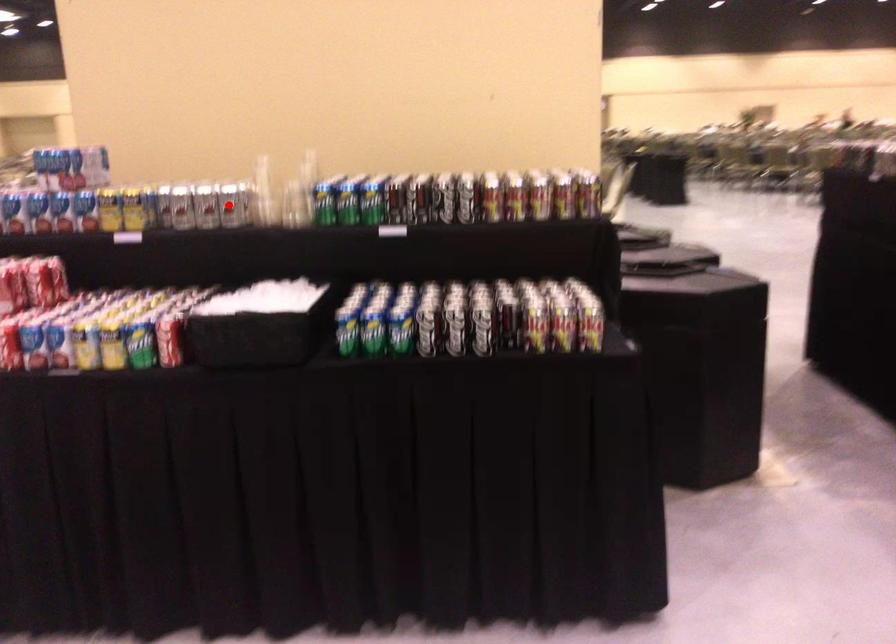
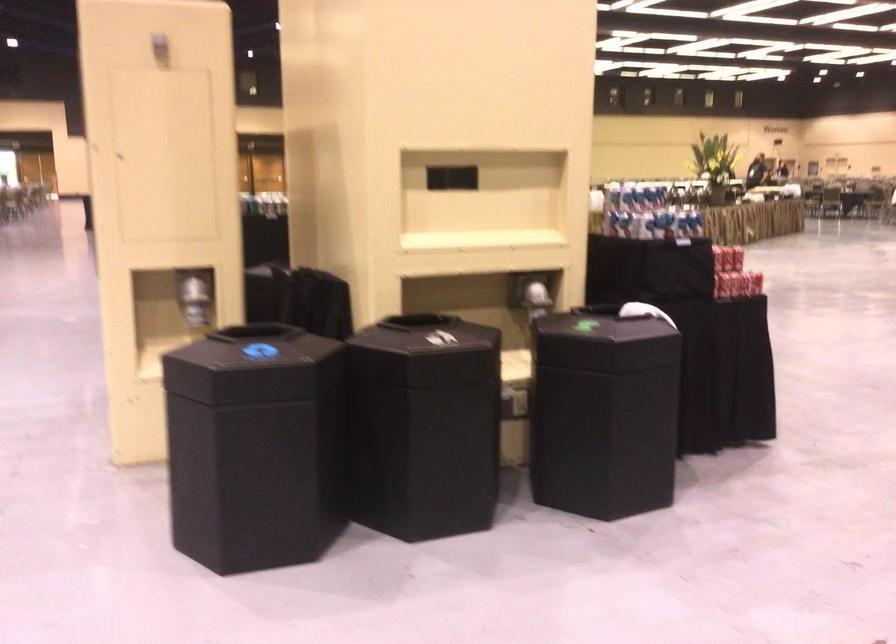
Question: I am providing you with two images of the same scene from different viewpoints. A red point is marked on the first image. At the location where the point appears in image 1, is it still visible in image 2?

Choices:
 (A) Yes
 (B) No

Answer: (B)